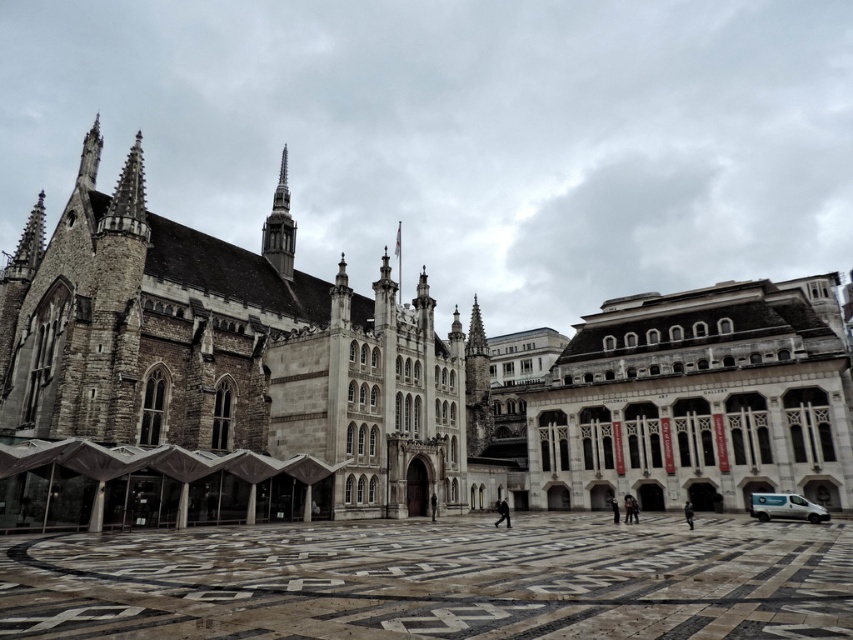
Does stone church at center have a lesser height compared to marble floor at center?

No, stone church at center is not shorter than marble floor at center.

Which is below, stone church at center or marble floor at center?

marble floor at center

Who is more distant from viewer, [799,394] or [212,595]?

The point [799,394] is more distant.

You are a GUI agent. You are given a task and a screenshot of the screen. Output one action in this format:
    pyautogui.click(x=<x>, y=<y>)
    Task: Click on the stone church at center
    This screenshot has width=853, height=640.
    Given the screenshot: What is the action you would take?
    pyautogui.click(x=393, y=381)

Who is more forward, (276, 266) or (758, 500)?

Point (758, 500)

Who is more distant from viewer, (265, 221) or (791, 500)?

The point (265, 221) is behind.

What are the coordinates of `silver spire at center` in the screenshot? It's located at (279, 227).

Who is positioned more to the right, white stone building at center or white metallic van at lower right?

From the viewer's perspective, white stone building at center appears more on the right side.

Can you confirm if white stone building at center is positioned to the left of white metallic van at lower right?

No, white stone building at center is not to the left of white metallic van at lower right.

Identify the location of white stone building at center. (697, 401).